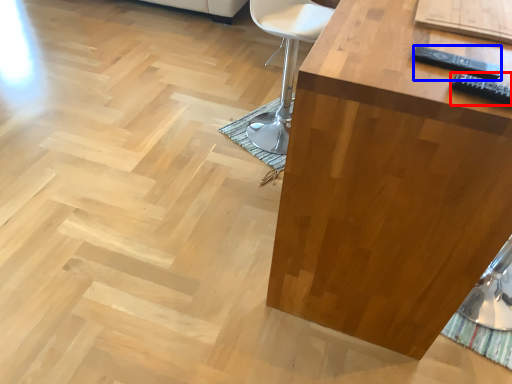
Question: Which object is further to the camera taking this photo, remote (highlighted by a red box) or remote (highlighted by a blue box)?

Choices:
 (A) remote
 (B) remote

Answer: (B)